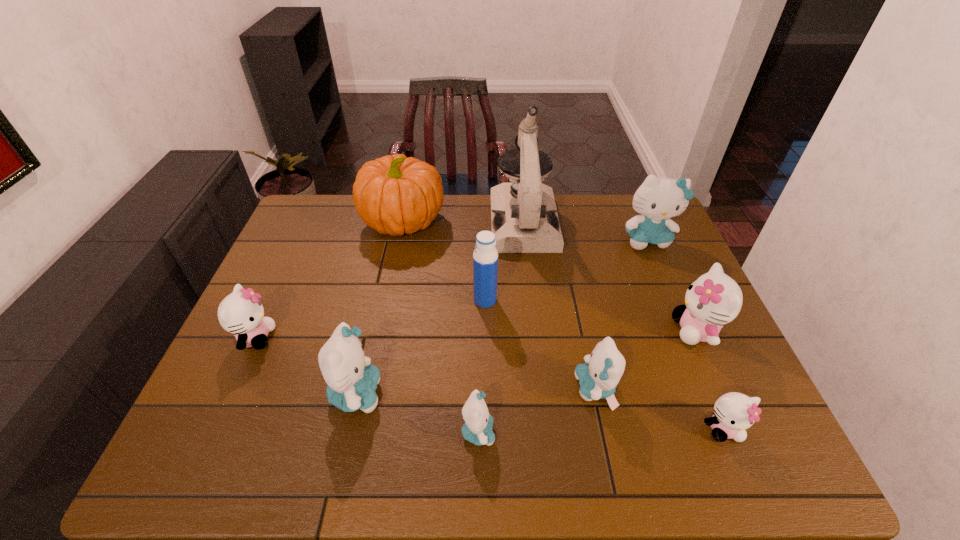
I want to click on unoccupied area between the smallest white kitten and the third kitten from left to right, so click(601, 430).

Where is `vacant area between the fourth kitten from right to left and the microscope`? This screenshot has height=540, width=960. vacant area between the fourth kitten from right to left and the microscope is located at coordinates (560, 305).

I want to click on free point between the leftmost blue kitten and the nearest white kitten, so click(540, 411).

You are a GUI agent. You are given a task and a screenshot of the screen. Output one action in this format:
    pyautogui.click(x=<x>, y=<y>)
    Task: Click on the free space between the pumpkin and the microscope
    
    Given the screenshot: What is the action you would take?
    [x=464, y=221]

Where is `free space between the fourth kitten from right to left and the biggest white kitten`? free space between the fourth kitten from right to left and the biggest white kitten is located at coordinates (646, 359).

Locate an element on the screen. This screenshot has width=960, height=540. free spot between the pumpkin and the blue water bottle is located at coordinates (444, 260).

Find the location of a particular element. The image size is (960, 540). unoccupied area between the water bottle and the leftmost white kitten is located at coordinates (371, 319).

Where is `the seventh closest object to the pumpkin`? The height and width of the screenshot is (540, 960). the seventh closest object to the pumpkin is located at coordinates (477, 429).

You are a GUI agent. You are given a task and a screenshot of the screen. Output one action in this format:
    pyautogui.click(x=<x>, y=<y>)
    Task: Click on the object that is the nearest to the microscope
    The height and width of the screenshot is (540, 960).
    Given the screenshot: What is the action you would take?
    click(x=394, y=194)

Choose which kitten is the seventh nearest neighbor to the tallest object. Please provide its 2D coordinates. Your answer should be formatted as a tuple, i.e. [(x, y)], where the tuple contains the x and y coordinates of a point satisfying the conditions above.

[(241, 313)]